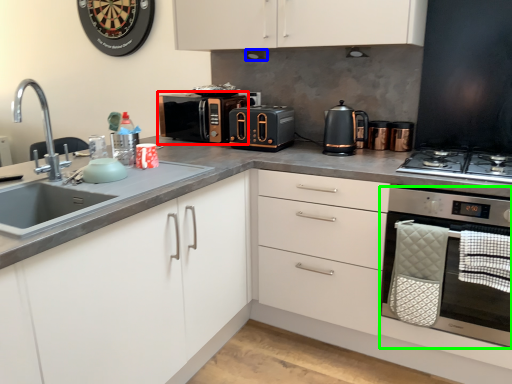
Question: Based on their relative distances, which object is nearer to microwave oven (highlighted by a red box)? Choose from exhaust hood (highlighted by a blue box) and home appliance (highlighted by a green box).

Choices:
 (A) exhaust hood
 (B) home appliance

Answer: (A)